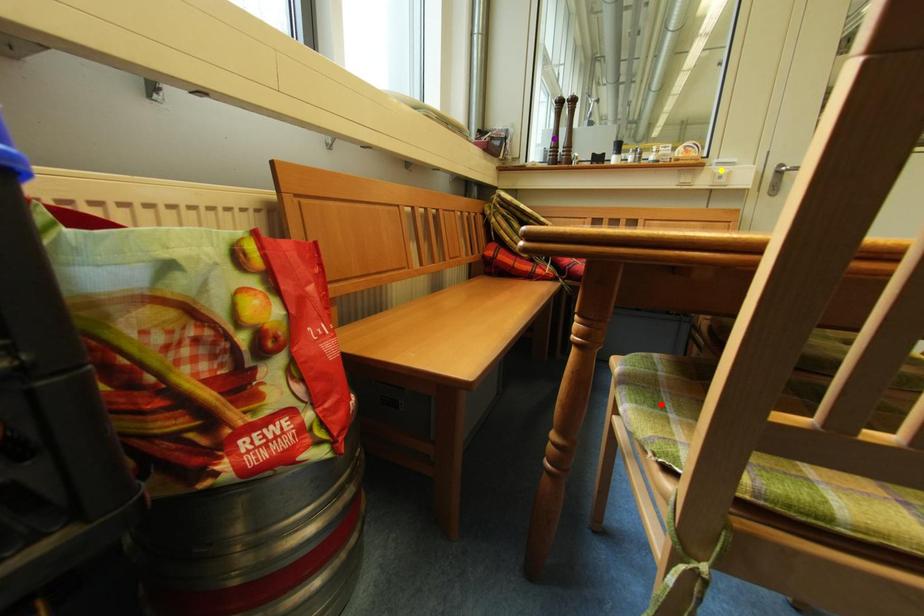
Order these from farthest to nearest:
- red point
- yellow point
- purple point

purple point → yellow point → red point